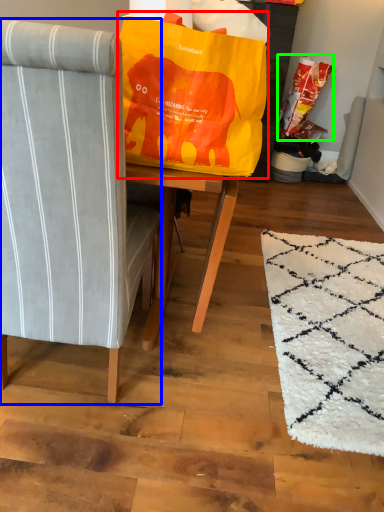
Question: Which object is positioned farthest from bean bag chair (highlighted by a red box)? Select from chair (highlighted by a blue box) and grocery bag (highlighted by a green box).

Choices:
 (A) chair
 (B) grocery bag

Answer: (B)